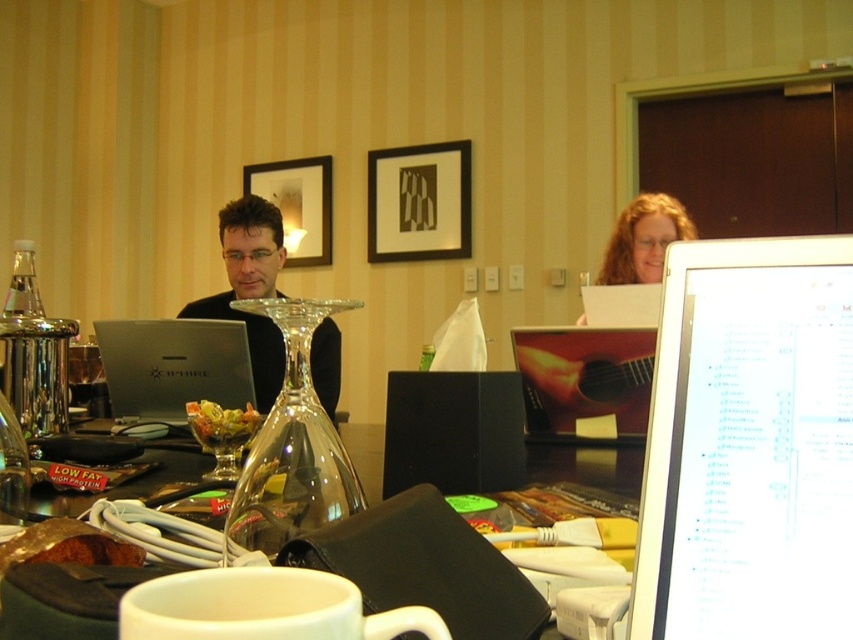
Question: Which point is farther to the camera?

Choices:
 (A) (790, 288)
 (B) (248, 419)
 (C) (612, 237)

Answer: (C)

Question: Considering the real-world distances, which object is closest to the blonde hair at upper right?

Choices:
 (A) translucent glass table at center
 (B) white glossy computer monitor at upper right
 (C) silver metallic laptop at center
 (D) green leafy salad at center

Answer: (A)

Question: Is translucent glass table at center wider than blonde hair at upper right?

Choices:
 (A) yes
 (B) no

Answer: (B)

Question: Where is white glossy computer monitor at upper right located in relation to blonde hair at upper right in the image?

Choices:
 (A) left
 (B) right

Answer: (A)

Question: In this image, where is translucent glass table at center located relative to green leafy salad at center?

Choices:
 (A) left
 (B) right

Answer: (B)

Question: Which of these objects is positioned closest to the silver metallic laptop at center?

Choices:
 (A) white glossy computer monitor at upper right
 (B) matte black laptop at center
 (C) blonde hair at upper right
 (D) green leafy salad at center

Answer: (B)